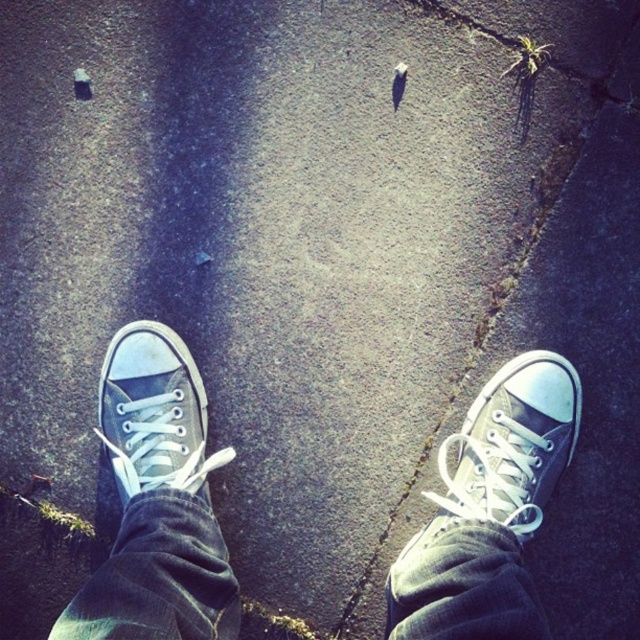
Can you confirm if green canvas shoe at center is wider than gray canvas shoe at center?

Yes, green canvas shoe at center is wider than gray canvas shoe at center.

Does green canvas shoe at center appear over gray canvas shoe at center?

Incorrect, green canvas shoe at center is not positioned above gray canvas shoe at center.

You are a GUI agent. You are given a task and a screenshot of the screen. Output one action in this format:
    pyautogui.click(x=<x>, y=<y>)
    Task: Click on the green canvas shoe at center
    The width and height of the screenshot is (640, 640).
    Given the screenshot: What is the action you would take?
    pos(488,509)

Who is positioned more to the left, white canvas sneakers at center or gray canvas shoe at center?

Positioned to the left is gray canvas shoe at center.

Find the location of a particular element. The image size is (640, 640). white canvas sneakers at center is located at coordinates (156, 502).

Who is lower down, white canvas sneakers at center or green canvas shoe at center?

Positioned lower is green canvas shoe at center.

Between white canvas sneakers at center and green canvas shoe at center, which one is positioned higher?

white canvas sneakers at center is higher up.

Where is `white canvas sneakers at center`? Image resolution: width=640 pixels, height=640 pixels. white canvas sneakers at center is located at coordinates (156, 502).